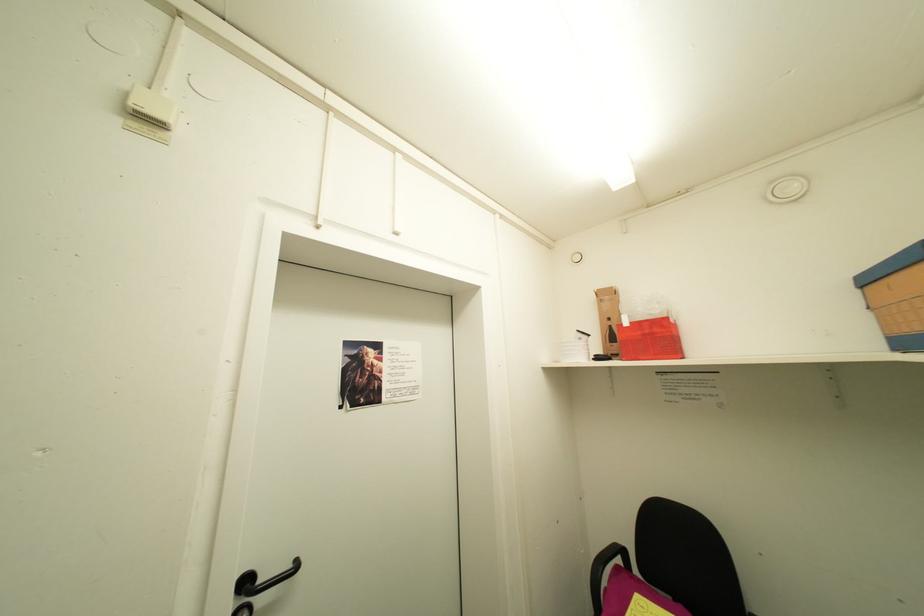
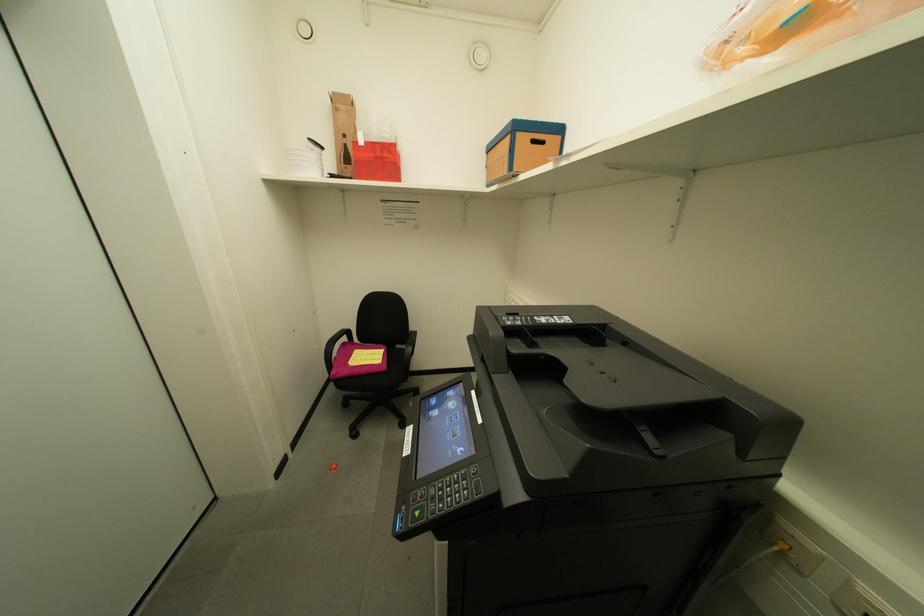
The images are taken continuously from a first-person perspective. In which direction is your viewpoint rotating?

The rotation direction of the camera is right-down.